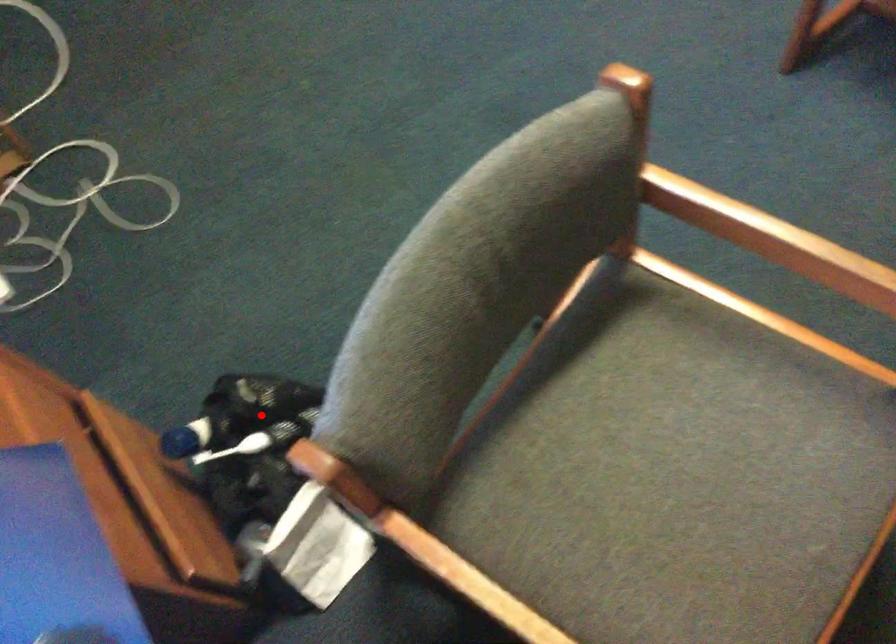
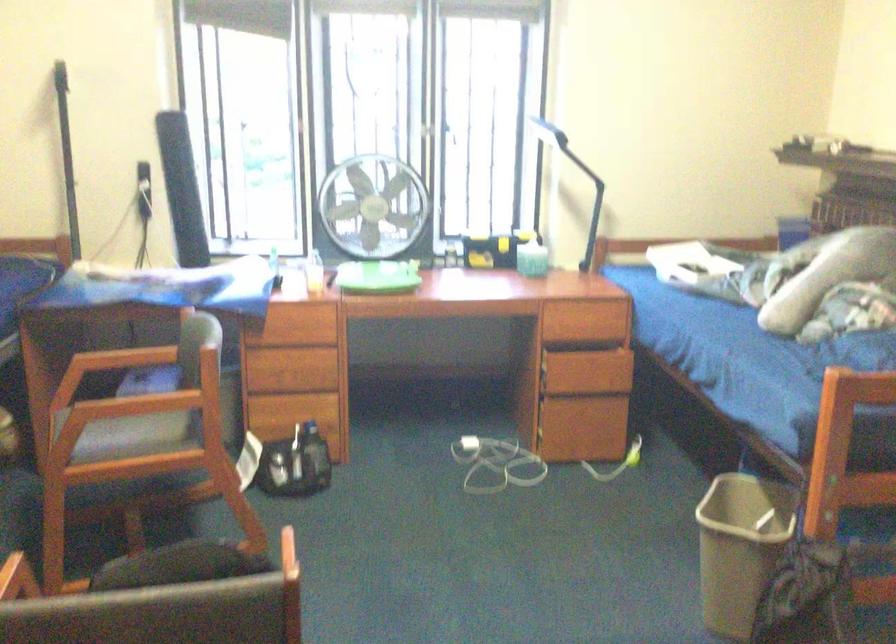
Find the pixel in the second image that matches the highlighted location in the first image.

(314, 457)